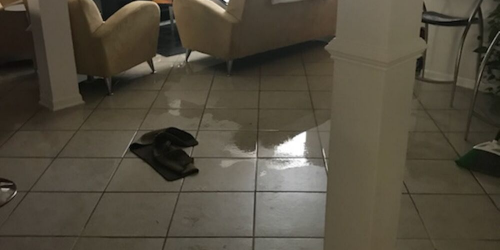
Where is `left single seater couch`? left single seater couch is located at coordinates (120, 48).